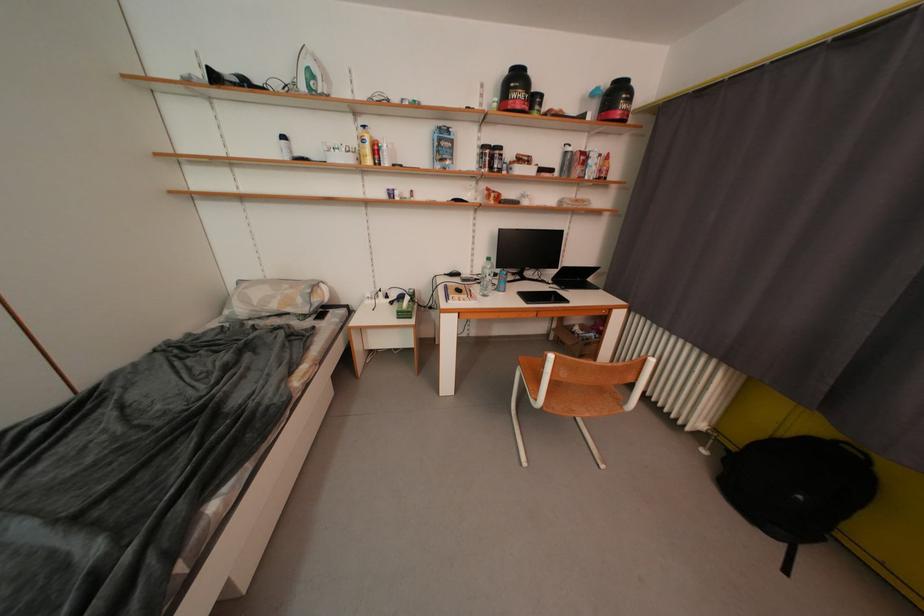
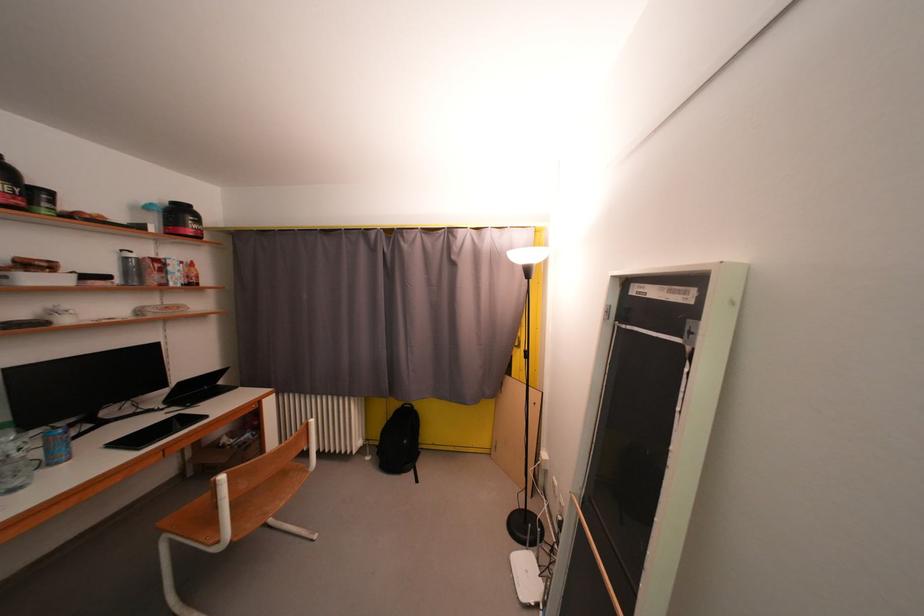
The point at [561,283] is marked in the first image. Where is the corresponding point in the second image?

(174, 405)